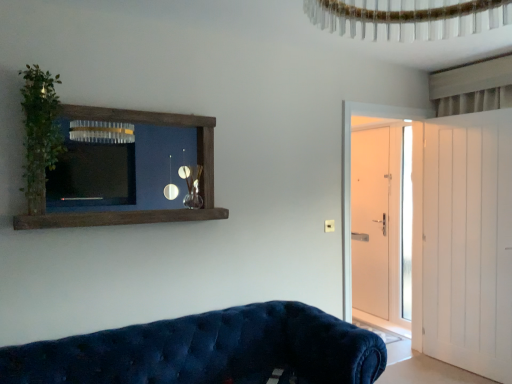
Describe the element at coordinates (350, 175) in the screenshot. I see `white wooden door at right, placed as the second door when sorted from back to front` at that location.

Measure the distance between white wooden door at right, the 2th door from the front, and camera.

white wooden door at right, the 2th door from the front, is 3.05 meters away from camera.

This screenshot has height=384, width=512. What do you see at coordinates (138, 210) in the screenshot?
I see `brown wooden shelf at upper left` at bounding box center [138, 210].

The height and width of the screenshot is (384, 512). Describe the element at coordinates (40, 134) in the screenshot. I see `green leafy plant at left` at that location.

Image resolution: width=512 pixels, height=384 pixels. I want to click on green leafy plant at left, so click(40, 134).

What is the approximate width of velvet blue couch at lower left?

The width of velvet blue couch at lower left is 36.18 inches.

Locate an element on the screen. This screenshot has width=512, height=384. white wooden door at right, the 2th door from the front is located at coordinates (350, 175).

Looking at their sizes, would you say white smooth door at right, the 1th door from the back, is wider or thinner than velvet blue couch at lower left?

Clearly, white smooth door at right, the 1th door from the back, has less width compared to velvet blue couch at lower left.

From the image's perspective, is white smooth door at right, the 1th door from the back, above or below velvet blue couch at lower left?

From the image's perspective, white smooth door at right, the 1th door from the back, appears above velvet blue couch at lower left.

How different are the orientations of white smooth door at right, the 1th door from the back, and velvet blue couch at lower left in degrees?

white smooth door at right, the 1th door from the back, and velvet blue couch at lower left are facing 89.9 degrees away from each other.

Between brown wooden shelf at upper left and white smooth door at right, the 1th door from the back, which one has smaller width?

Thinner between the two is white smooth door at right, the 1th door from the back.

Does brown wooden shelf at upper left contain white smooth door at right, the 1th door from the back?

Actually, white smooth door at right, the 1th door from the back, is outside brown wooden shelf at upper left.

Can you confirm if brown wooden shelf at upper left is positioned to the right of white smooth door at right, the 1th door from the back?

No.

Is brown wooden shelf at upper left placed right next to white smooth door at right, the 1th door from the back?

No, brown wooden shelf at upper left is not beside white smooth door at right, the 1th door from the back.

Considering the relative sizes of white smooth door at right, the third door from the front, and white wooden door at right, the first door positioned from the front, in the image provided, is white smooth door at right, the third door from the front, smaller than white wooden door at right, the first door positioned from the front,?

Correct, white smooth door at right, the third door from the front, occupies less space than white wooden door at right, the first door positioned from the front.

Is white smooth door at right, the 1th door from the back, in front of or behind white wooden door at right, the first door positioned from the front, in the image?

white smooth door at right, the 1th door from the back, is behind white wooden door at right, the first door positioned from the front.

Visually, is white smooth door at right, the third door from the front, positioned to the left or to the right of white wooden door at right, arranged as the 3th door when viewed from the back?

From the image, it's evident that white smooth door at right, the third door from the front, is to the left of white wooden door at right, arranged as the 3th door when viewed from the back.

Are white smooth door at right, the third door from the front, and white wooden door at right, arranged as the 3th door when viewed from the back, beside each other?

There is a gap between white smooth door at right, the third door from the front, and white wooden door at right, arranged as the 3th door when viewed from the back.

Does white wooden door at right, the first door positioned from the front, turn towards brown wooden shelf at upper left?

Yes, white wooden door at right, the first door positioned from the front, is oriented towards brown wooden shelf at upper left.

Is the surface of white wooden door at right, arranged as the 3th door when viewed from the back, in direct contact with brown wooden shelf at upper left?

white wooden door at right, arranged as the 3th door when viewed from the back, and brown wooden shelf at upper left are not in contact.

Measure the distance from white wooden door at right, arranged as the 3th door when viewed from the back, to brown wooden shelf at upper left.

white wooden door at right, arranged as the 3th door when viewed from the back, and brown wooden shelf at upper left are 6.82 feet apart from each other.

Can you tell me how much white wooden door at right, arranged as the 3th door when viewed from the back, and brown wooden shelf at upper left differ in facing direction?

They differ by 88.5 degrees in their facing directions.

Considering the sizes of green leafy plant at left and white wooden door at right, the 2th door from the front, in the image, is green leafy plant at left wider or thinner than white wooden door at right, the 2th door from the front,?

Considering their sizes, green leafy plant at left looks slimmer than white wooden door at right, the 2th door from the front.

From the picture: Is green leafy plant at left oriented towards white wooden door at right, placed as the second door when sorted from back to front?

No, green leafy plant at left is not facing towards white wooden door at right, placed as the second door when sorted from back to front.

From the image's perspective, which one is positioned higher, green leafy plant at left or white wooden door at right, the 2th door from the front?

green leafy plant at left, from the image's perspective.

Which is closer to the camera, (46, 139) or (347, 208)?

The point (46, 139) is more forward.

How many degrees apart are the facing directions of white smooth door at right, the third door from the front, and brown wooden shelf at upper left?

The angular difference between white smooth door at right, the third door from the front, and brown wooden shelf at upper left is 90.2 degrees.

Is white smooth door at right, the 1th door from the back, not inside brown wooden shelf at upper left?

Absolutely, white smooth door at right, the 1th door from the back, is external to brown wooden shelf at upper left.

Is white smooth door at right, the third door from the front, closer to the viewer compared to brown wooden shelf at upper left?

→ No, the depth of white smooth door at right, the third door from the front, is greater than that of brown wooden shelf at upper left.

Consider the image. Is brown wooden shelf at upper left at the back of white smooth door at right, the third door from the front?

No, brown wooden shelf at upper left is not at the back of white smooth door at right, the third door from the front.

Is white wooden door at right, placed as the second door when sorted from back to front, oriented towards velvet blue couch at lower left?

No, white wooden door at right, placed as the second door when sorted from back to front, does not turn towards velvet blue couch at lower left.

Which object is wider, white wooden door at right, placed as the second door when sorted from back to front, or velvet blue couch at lower left?

velvet blue couch at lower left.

Which of these two, white wooden door at right, the 2th door from the front, or velvet blue couch at lower left, is smaller?

Smaller between the two is white wooden door at right, the 2th door from the front.

Considering the relative sizes of white wooden door at right, the 2th door from the front, and velvet blue couch at lower left in the image provided, is white wooden door at right, the 2th door from the front, taller than velvet blue couch at lower left?

Yes, white wooden door at right, the 2th door from the front, is taller than velvet blue couch at lower left.

This screenshot has height=384, width=512. I want to click on studio couch in front of the white smooth door at right, the third door from the front, so click(x=207, y=351).

The height and width of the screenshot is (384, 512). What are the coordinates of `shelf above the white smooth door at right, the third door from the front (from the image's perspective)` in the screenshot? It's located at (138, 210).

Looking at the image, which one is located further to velvet blue couch at lower left, green leafy plant at left or white wooden door at right, arranged as the 3th door when viewed from the back?

white wooden door at right, arranged as the 3th door when viewed from the back, is positioned further to the anchor velvet blue couch at lower left.

Which object lies further to the anchor point white wooden door at right, arranged as the 3th door when viewed from the back, brown wooden shelf at upper left or white smooth door at right, the 1th door from the back?

A: Based on the image, brown wooden shelf at upper left appears to be further to white wooden door at right, arranged as the 3th door when viewed from the back.

Estimate the real-world distances between objects in this image. Which object is closer to green leafy plant at left, brown wooden shelf at upper left or white smooth door at right, the 1th door from the back?

The object closer to green leafy plant at left is brown wooden shelf at upper left.

Looking at the image, which one is located closer to velvet blue couch at lower left, white smooth door at right, the third door from the front, or brown wooden shelf at upper left?

brown wooden shelf at upper left.

Estimate the real-world distances between objects in this image. Which object is further from brown wooden shelf at upper left, velvet blue couch at lower left or white smooth door at right, the third door from the front?

A: white smooth door at right, the third door from the front.

In the scene shown: Based on their spatial positions, is velvet blue couch at lower left or white smooth door at right, the third door from the front, further from white wooden door at right, placed as the second door when sorted from back to front?

Based on the image, white smooth door at right, the third door from the front, appears to be further to white wooden door at right, placed as the second door when sorted from back to front.

When comparing their distances from green leafy plant at left, does white wooden door at right, the 2th door from the front, or brown wooden shelf at upper left seem further?

white wooden door at right, the 2th door from the front.

Estimate the real-world distances between objects in this image. Which object is closer to velvet blue couch at lower left, brown wooden shelf at upper left or white wooden door at right, placed as the second door when sorted from back to front?

brown wooden shelf at upper left is positioned closer to the anchor velvet blue couch at lower left.

This screenshot has height=384, width=512. I want to click on plant between velvet blue couch at lower left and white smooth door at right, the third door from the front, along the z-axis, so click(x=40, y=134).

At what (x,y) coordinates should I click in order to perform the action: click on shelf positioned between velvet blue couch at lower left and white wooden door at right, the 2th door from the front, from near to far. Please return your answer as a coordinate pair (x, y). The width and height of the screenshot is (512, 384). Looking at the image, I should click on (138, 210).

The image size is (512, 384). I want to click on door located between white wooden door at right, the first door positioned from the front, and white smooth door at right, the third door from the front, in the depth direction, so pyautogui.click(x=350, y=175).

Where is `studio couch between brown wooden shelf at upper left and white wooden door at right, arranged as the 3th door when viewed from the back`? The width and height of the screenshot is (512, 384). studio couch between brown wooden shelf at upper left and white wooden door at right, arranged as the 3th door when viewed from the back is located at coordinates (207, 351).